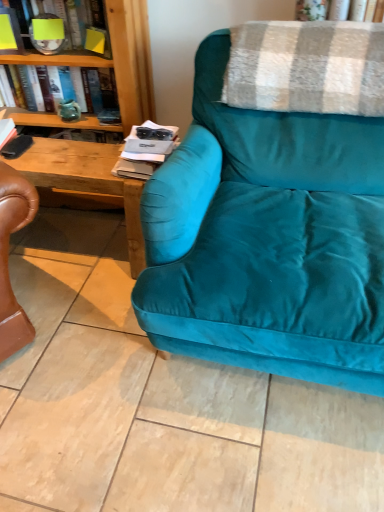
What is the approximate width of teal velvet couch at center?

It is 1.18 meters.

Image resolution: width=384 pixels, height=512 pixels. What are the coordinates of `matte black magazine at center` in the screenshot? It's located at click(x=145, y=150).

In order to face yellow paper at upper left, the 2th book when ordered from bottom to top, should I rotate leftwards or rightwards?

To align with it, rotate left about 16.823°.

Measure the distance between point (x=115, y=103) and camera.

Point (x=115, y=103) and camera are 1.89 meters apart from each other.

What do you see at coordinates (99, 88) in the screenshot?
I see `green glass vase at upper left, acting as the 1th book starting from the bottom` at bounding box center [99, 88].

Find the location of a particular element. This screenshot has height=512, width=384. teal velvet couch at center is located at coordinates (268, 239).

Which is behind, teal glass vase at upper left or yellow paper at upper left, the 2th book when ordered from bottom to top?

teal glass vase at upper left.

Is teal glass vase at upper left oriented towards yellow paper at upper left, the 2th book when ordered from bottom to top?

No, teal glass vase at upper left is not aimed at yellow paper at upper left, the 2th book when ordered from bottom to top.

Between teal glass vase at upper left and yellow paper at upper left, the 2th book when ordered from bottom to top, which one has larger size?

yellow paper at upper left, the 2th book when ordered from bottom to top, is bigger.

Between teal glass vase at upper left and yellow paper at upper left, the 2th book when ordered from bottom to top, which one has less height?

teal glass vase at upper left is shorter.

Considering the relative sizes of matte black magazine at center and teal velvet couch at center in the image provided, is matte black magazine at center shorter than teal velvet couch at center?

Yes, matte black magazine at center is shorter than teal velvet couch at center.

Which point is more distant from viewer, (143, 175) or (184, 144)?

The point (143, 175) is more distant.

Is matte black magazine at center placed right next to teal velvet couch at center?

No, matte black magazine at center is not touching teal velvet couch at center.

Is matte black magazine at center positioned with its back to teal velvet couch at center?

No, matte black magazine at center is not facing the opposite direction of teal velvet couch at center.

Where is `book that is the 2nd object to the left of the teal velvet couch at center, starting at the anchor`? Image resolution: width=384 pixels, height=512 pixels. book that is the 2nd object to the left of the teal velvet couch at center, starting at the anchor is located at coordinates (99, 88).

Could you measure the distance between green glass vase at upper left, acting as the 1th book starting from the bottom, and teal velvet couch at center?

green glass vase at upper left, acting as the 1th book starting from the bottom, and teal velvet couch at center are 37.89 inches apart from each other.

From a real-world perspective, who is located higher, green glass vase at upper left, which appears as the second book when viewed from the top, or teal velvet couch at center?

In real-world perspective, green glass vase at upper left, which appears as the second book when viewed from the top, is above.

From the image's perspective, is green glass vase at upper left, which appears as the second book when viewed from the top, on top of teal velvet couch at center?

Indeed, from the image's perspective, green glass vase at upper left, which appears as the second book when viewed from the top, is shown above teal velvet couch at center.

Which object is further away from the camera taking this photo, yellow paper at upper left, arranged as the 1th book when viewed from the top, or teal glass vase at upper left?

teal glass vase at upper left.

From the image's perspective, is yellow paper at upper left, arranged as the 1th book when viewed from the top, above teal glass vase at upper left?

Yes, from the image's perspective, yellow paper at upper left, arranged as the 1th book when viewed from the top, is above teal glass vase at upper left.

Considering the relative sizes of yellow paper at upper left, the 2th book when ordered from bottom to top, and teal glass vase at upper left in the image provided, is yellow paper at upper left, the 2th book when ordered from bottom to top, wider than teal glass vase at upper left?

Indeed, yellow paper at upper left, the 2th book when ordered from bottom to top, has a greater width compared to teal glass vase at upper left.

Between yellow paper at upper left, the 2th book when ordered from bottom to top, and teal glass vase at upper left, which one has larger size?

With larger size is yellow paper at upper left, the 2th book when ordered from bottom to top.

From a real-world perspective, does teal velvet couch at center sit lower than green glass vase at upper left, acting as the 1th book starting from the bottom?

Indeed, from a real-world perspective, teal velvet couch at center is positioned beneath green glass vase at upper left, acting as the 1th book starting from the bottom.

Can you confirm if teal velvet couch at center is positioned to the left of green glass vase at upper left, acting as the 1th book starting from the bottom?

No.

Is teal velvet couch at center next to green glass vase at upper left, acting as the 1th book starting from the bottom?

No, teal velvet couch at center is not with green glass vase at upper left, acting as the 1th book starting from the bottom.

Is teal velvet couch at center facing towards green glass vase at upper left, acting as the 1th book starting from the bottom?

No, teal velvet couch at center is not turned towards green glass vase at upper left, acting as the 1th book starting from the bottom.

What's the angular difference between plaid woolen blanket at upper right and teal velvet couch at center's facing directions?

There is a 2.2-degree angle between the facing directions of plaid woolen blanket at upper right and teal velvet couch at center.

Between plaid woolen blanket at upper right and teal velvet couch at center, which one is positioned behind?

Positioned behind is plaid woolen blanket at upper right.

Is plaid woolen blanket at upper right placed right next to teal velvet couch at center?

plaid woolen blanket at upper right is not next to teal velvet couch at center, and they're not touching.

Between plaid woolen blanket at upper right and teal velvet couch at center, which one has smaller width?

Thinner between the two is plaid woolen blanket at upper right.

Considering the sizes of objects matte black magazine at center and green glass vase at upper left, which appears as the second book when viewed from the top, in the image provided, who is thinner, matte black magazine at center or green glass vase at upper left, which appears as the second book when viewed from the top,?

green glass vase at upper left, which appears as the second book when viewed from the top, is thinner.

Consider the image. Is matte black magazine at center oriented away from green glass vase at upper left, acting as the 1th book starting from the bottom?

No, matte black magazine at center is not facing away from green glass vase at upper left, acting as the 1th book starting from the bottom.

From a real-world perspective, does matte black magazine at center sit lower than green glass vase at upper left, acting as the 1th book starting from the bottom?

Yes, from a real-world perspective, matte black magazine at center is below green glass vase at upper left, acting as the 1th book starting from the bottom.

Between matte black magazine at center and green glass vase at upper left, which appears as the second book when viewed from the top, which one has larger size?

green glass vase at upper left, which appears as the second book when viewed from the top.

Identify the location of teal behind the yellow paper at upper left, arranged as the 1th book when viewed from the top. This screenshot has height=512, width=384. (69, 110).

The width and height of the screenshot is (384, 512). Identify the location of studio couch in front of the matte black magazine at center. [268, 239].

When comparing their distances from green glass vase at upper left, which appears as the second book when viewed from the top, does teal velvet couch at center or matte black magazine at center seem further?

teal velvet couch at center is further to green glass vase at upper left, which appears as the second book when viewed from the top.

Looking at the image, which one is located closer to plaid woolen blanket at upper right, teal glass vase at upper left or green glass vase at upper left, acting as the 1th book starting from the bottom?

Based on the image, green glass vase at upper left, acting as the 1th book starting from the bottom, appears to be nearer to plaid woolen blanket at upper right.

Which object lies further to the anchor point teal velvet couch at center, yellow paper at upper left, arranged as the 1th book when viewed from the top, or teal glass vase at upper left?

teal glass vase at upper left is further to teal velvet couch at center.

Based on their spatial positions, is plaid woolen blanket at upper right or green glass vase at upper left, which appears as the second book when viewed from the top, closer to yellow paper at upper left, the 2th book when ordered from bottom to top?

green glass vase at upper left, which appears as the second book when viewed from the top, is closer to yellow paper at upper left, the 2th book when ordered from bottom to top.

When comparing their distances from matte black magazine at center, does green glass vase at upper left, acting as the 1th book starting from the bottom, or yellow paper at upper left, the 2th book when ordered from bottom to top, seem closer?

green glass vase at upper left, acting as the 1th book starting from the bottom.

Based on their spatial positions, is yellow paper at upper left, arranged as the 1th book when viewed from the top, or matte black magazine at center closer to teal glass vase at upper left?

The object closer to teal glass vase at upper left is yellow paper at upper left, arranged as the 1th book when viewed from the top.

When comparing their distances from green glass vase at upper left, acting as the 1th book starting from the bottom, does yellow paper at upper left, the 2th book when ordered from bottom to top, or plaid woolen blanket at upper right seem closer?

The object closer to green glass vase at upper left, acting as the 1th book starting from the bottom, is yellow paper at upper left, the 2th book when ordered from bottom to top.

When comparing their distances from yellow paper at upper left, the 2th book when ordered from bottom to top, does green glass vase at upper left, which appears as the second book when viewed from the top, or teal glass vase at upper left seem further?

Based on the image, teal glass vase at upper left appears to be further to yellow paper at upper left, the 2th book when ordered from bottom to top.

Identify the location of blanket positioned between teal velvet couch at center and teal glass vase at upper left from near to far. (307, 67).

Locate an element on the screen. The width and height of the screenshot is (384, 512). teal between yellow paper at upper left, arranged as the 1th book when viewed from the top, and plaid woolen blanket at upper right, in the horizontal direction is located at coordinates (69, 110).

Image resolution: width=384 pixels, height=512 pixels. I want to click on magazine between green glass vase at upper left, which appears as the second book when viewed from the top, and plaid woolen blanket at upper right from left to right, so click(x=145, y=150).

Identify the location of magazine between yellow paper at upper left, the 2th book when ordered from bottom to top, and plaid woolen blanket at upper right, in the horizontal direction. (145, 150).